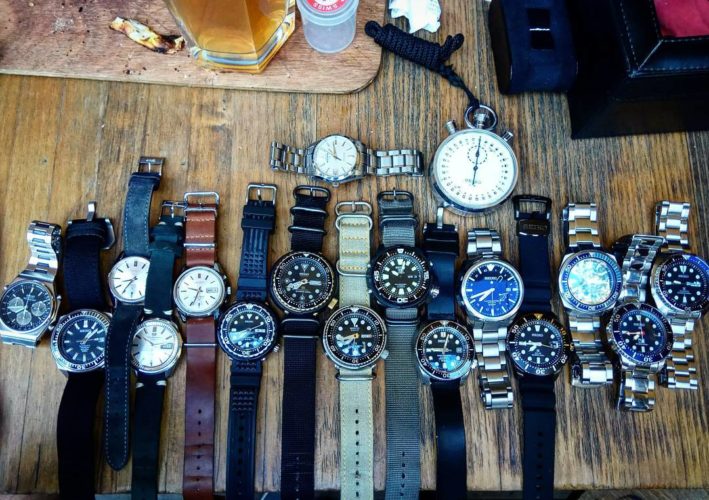
The height and width of the screenshot is (500, 709). What are the coordinates of `glass` in the screenshot? It's located at (218, 42).